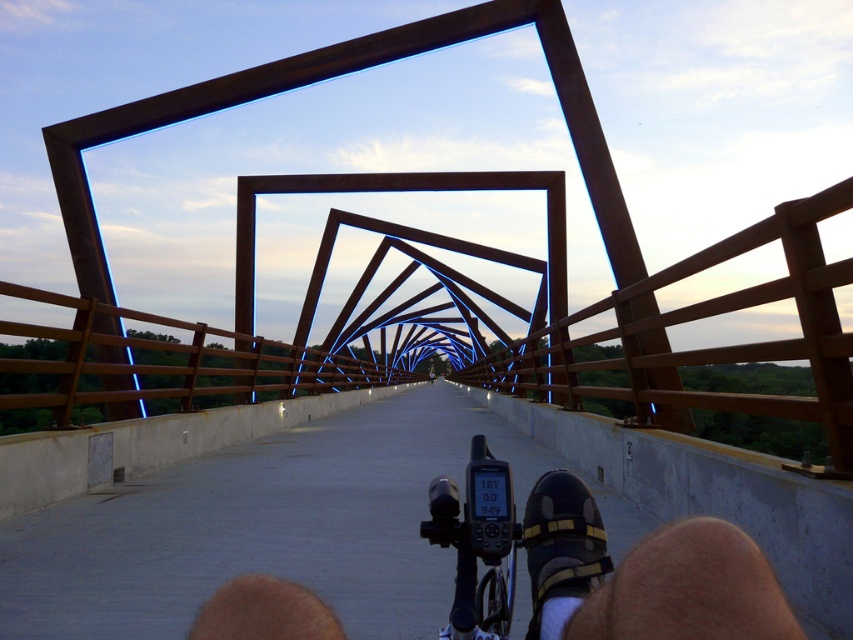
You are riding a bike on a futuristic bridge and want to check if your shoe is positioned safely above the rail. Based on the scene, can you confirm whether the black matte shoe at center is above the brown wooden rail at center?

Yes, the black matte shoe at center is above the brown wooden rail at center as described in the scene.

You are a cyclist riding a bike and you see the brown metallic bridge at center and the black plastic GPS at center. Which object is taller?

The brown metallic bridge at center is taller than the black plastic GPS at center.

In the scene shown: You are riding a bicycle and want to know if you can carry your black plastic GPS at center along with another item of the same size. The brown metallic bridge at center has a width that might affect this. Can you fit both items on the bridge?

The brown metallic bridge at center is wider than the black plastic GPS at center, so you can fit both items on the bridge since the bridge has enough width to accommodate them.